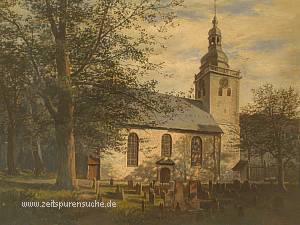
Locate an element on the screen. The width and height of the screenshot is (300, 225). center window is located at coordinates (164, 143).